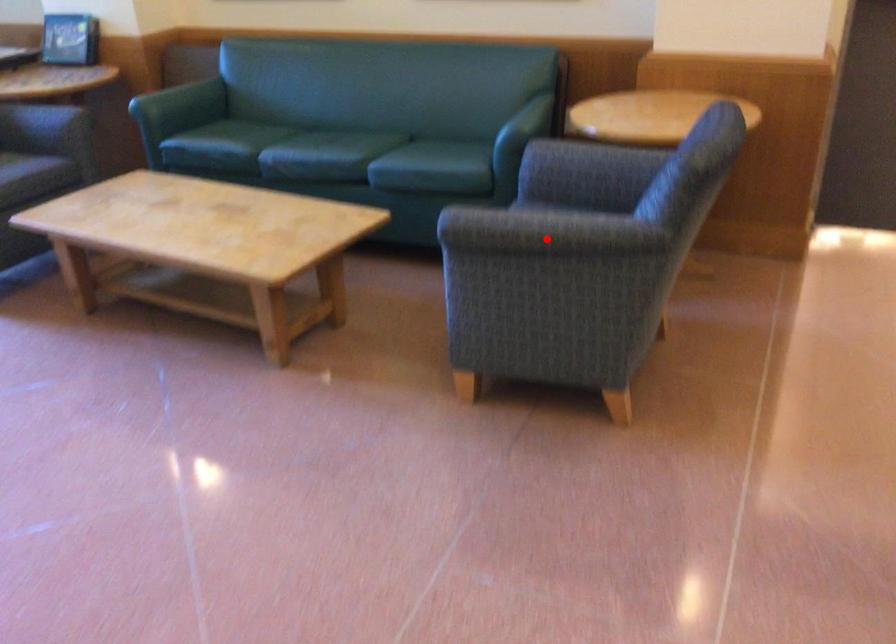
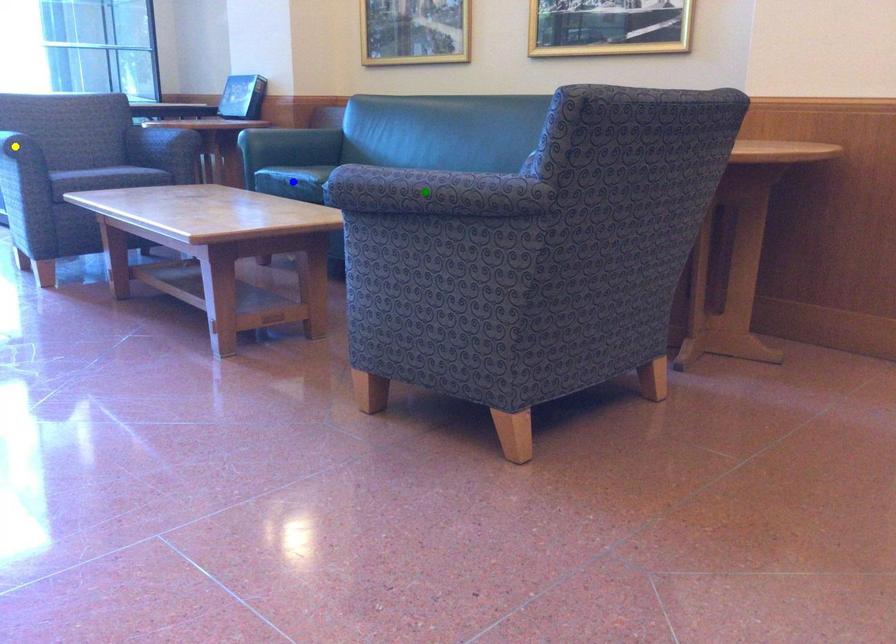
Question: I am providing you with two images of the same scene from different viewpoints. A red point is marked on the first image. You are given multiple points on the second image. Which spot in image 2 lines up with the point in image 1?

Choices:
 (A) yellow point
 (B) green point
 (C) blue point

Answer: (B)